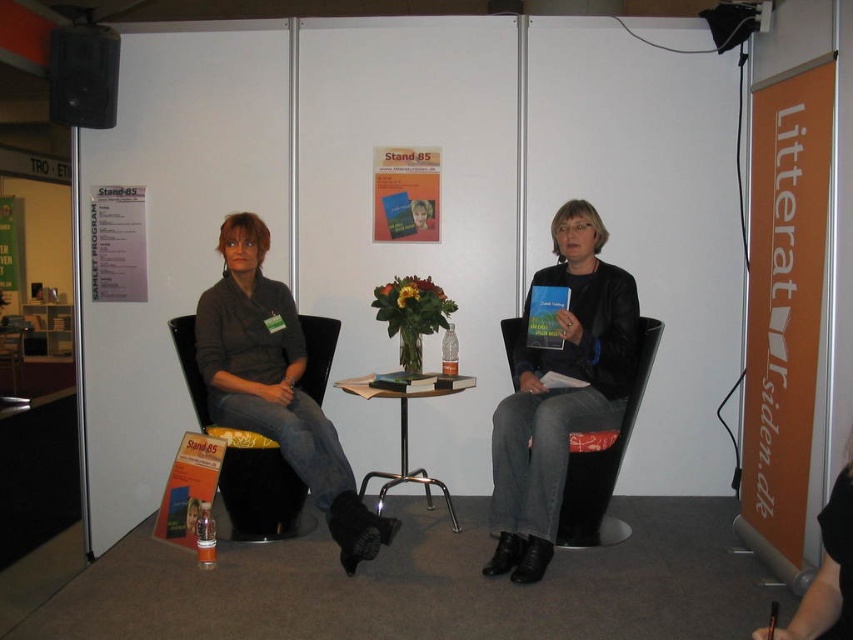
You are an event organizer and need to adjust the seating arrangement so that the black plastic chair at center is higher than the matte black sweater at center. How can you achieve this?

The matte black sweater at center is taller than the black plastic chair at center. To make the black plastic chair at center higher, you can place a thick cushion or a stack of books underneath the chair to elevate its height.

From the picture: You are organizing a photo shoot and need to place a decorative pillow between the matte black sweater at center and the black matte speaker at upper left. Which object should the pillow be placed closer to if you want it to be near the wider object?

The matte black sweater at center has a larger width than the black matte speaker at upper left, so the pillow should be placed closer to the matte black sweater at center.

What is located at the coordinates point (x=276, y=385)?

The point (x=276, y=385) indicates a matte black sweater at center.